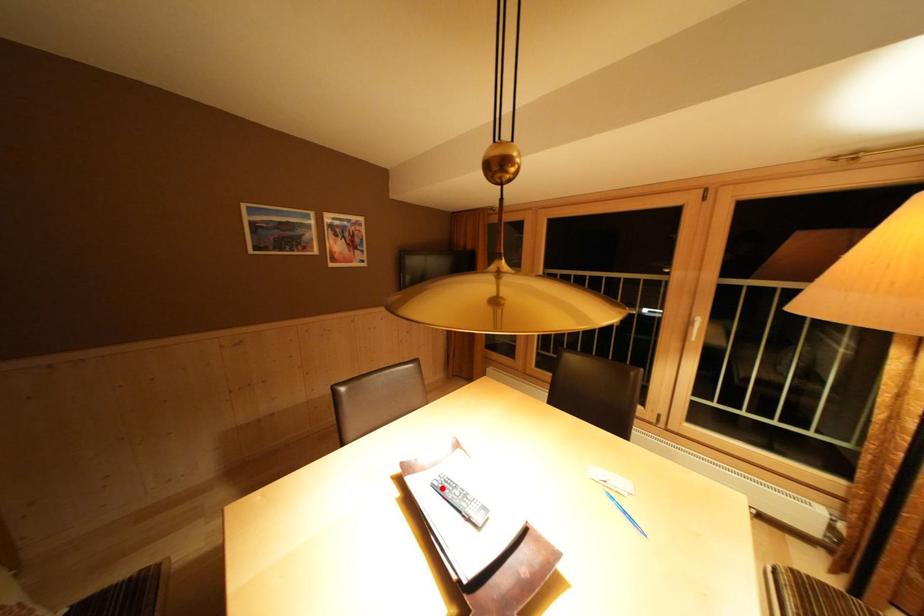
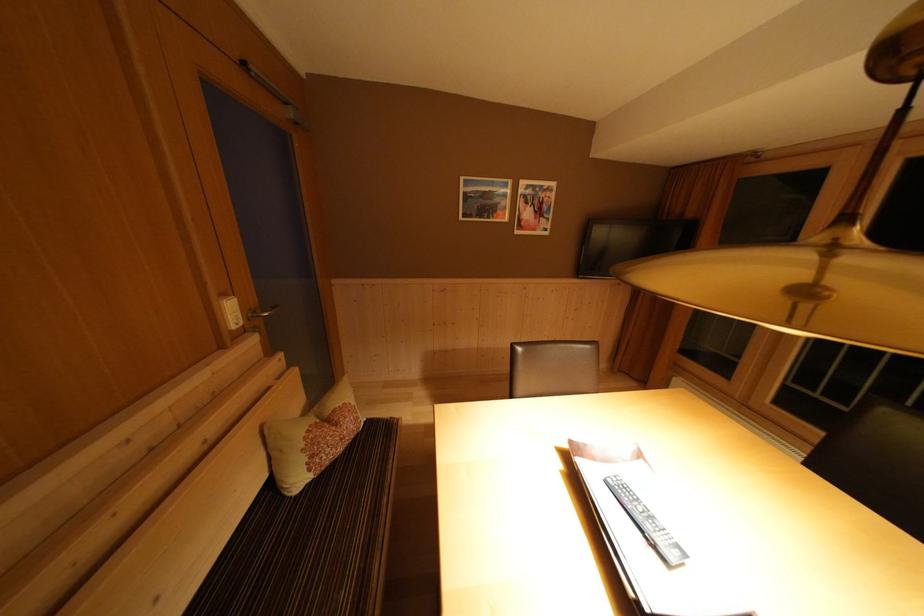
Find the pixel in the second image that matches the highlighted location in the first image.

(617, 485)